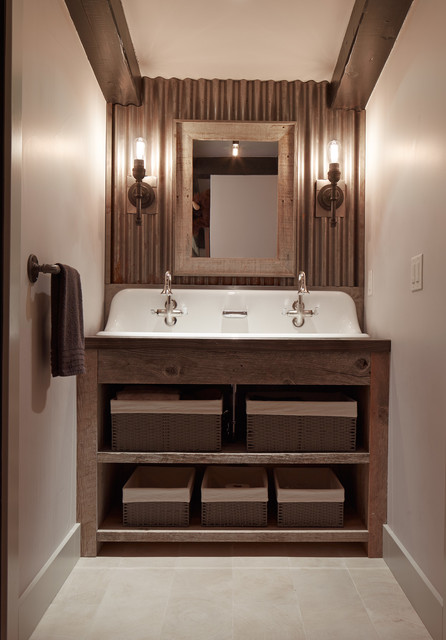
This screenshot has height=640, width=446. I want to click on sink, so click(x=202, y=317).